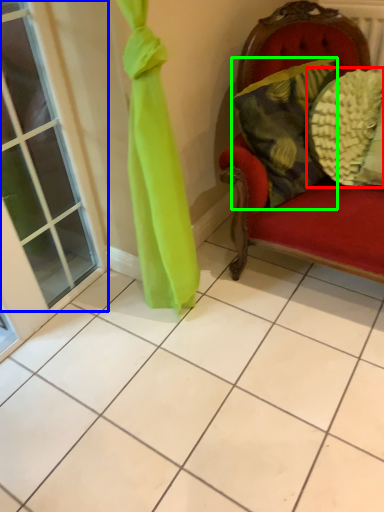
Question: Which object is positioned closest to pillow (highlighted by a red box)? Select from window (highlighted by a blue box) and pillow (highlighted by a green box).

Choices:
 (A) window
 (B) pillow

Answer: (B)